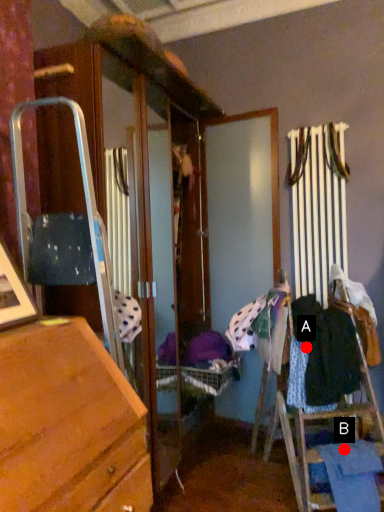
Question: Two points are circled on the image, labeled by A and B beside each circle. Among these points, which one is nearest to the camera?

Choices:
 (A) A is closer
 (B) B is closer

Answer: (B)